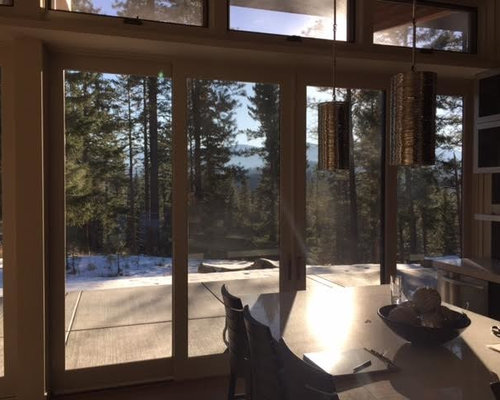
Locate an element on the screen. The height and width of the screenshot is (400, 500). chair is located at coordinates (235, 312), (259, 341), (316, 383).